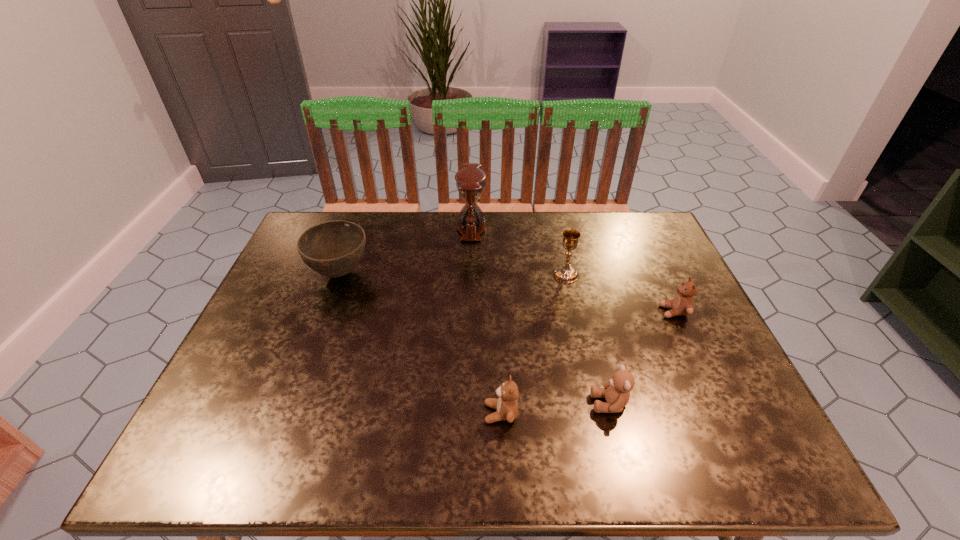
Find the location of a particular element. This screenshot has width=960, height=540. vacant area at the far left corner is located at coordinates (316, 224).

Where is `vacant region at the far right corner`? This screenshot has height=540, width=960. vacant region at the far right corner is located at coordinates (628, 213).

At what (x,y) coordinates should I click in order to perform the action: click on free space that is in between the second teddy bear from right to left and the chalice. Please return your answer as a coordinate pair (x, y). The width and height of the screenshot is (960, 540). Looking at the image, I should click on (588, 339).

Identify the location of empty location between the chalice and the rightmost teddy bear. (620, 293).

The width and height of the screenshot is (960, 540). In order to click on vacant space that's between the farthest object and the leftmost teddy bear in this screenshot , I will do `click(486, 321)`.

This screenshot has width=960, height=540. I want to click on free space between the leftmost teddy bear and the second teddy bear from left to right, so click(x=555, y=408).

Where is `vacant region between the chalice and the hourglass`? The width and height of the screenshot is (960, 540). vacant region between the chalice and the hourglass is located at coordinates (518, 251).

This screenshot has width=960, height=540. Identify the location of vacant space that is in between the leftmost teddy bear and the second teddy bear from right to left. (555, 408).

At what (x,y) coordinates should I click in order to perform the action: click on free area in between the bowl and the leftmost teddy bear. Please return your answer as a coordinate pair (x, y). Image resolution: width=960 pixels, height=540 pixels. Looking at the image, I should click on (420, 343).

At what (x,y) coordinates should I click in order to perform the action: click on vacant area that lies between the leftmost object and the second teddy bear from right to left. Please return your answer as a coordinate pair (x, y). This screenshot has width=960, height=540. Looking at the image, I should click on (475, 339).